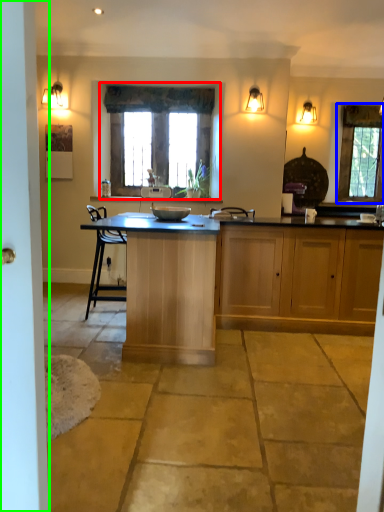
Question: Estimate the real-world distances between objects in this image. Which object is closer to window (highlighted by a red box), window (highlighted by a blue box) or screen door (highlighted by a green box)?

Choices:
 (A) window
 (B) screen door

Answer: (A)